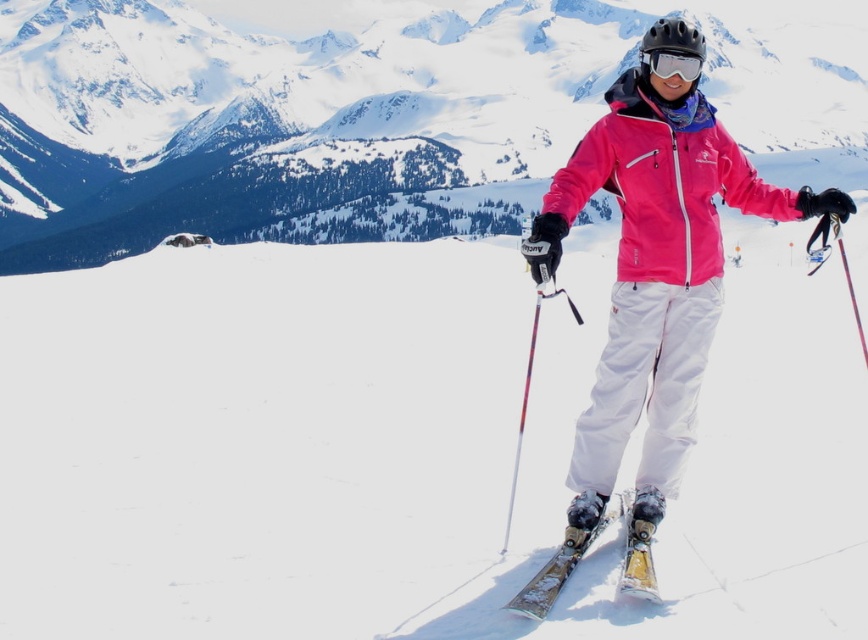
Question: Which point is farther from the camera taking this photo?

Choices:
 (A) pos(695,177)
 (B) pos(324,118)
 (C) pos(755,204)

Answer: (B)

Question: Is pink softshell jacket at center to the left of metallic gold ski at center from the viewer's perspective?

Choices:
 (A) yes
 (B) no

Answer: (B)

Question: Which is nearer to the transparent plastic goggles at center?

Choices:
 (A) pink softshell jacket at center
 (B) metallic gold ski at center

Answer: (A)

Question: Is metallic gold ski at lower center below transparent plastic goggles at center?

Choices:
 (A) no
 (B) yes

Answer: (B)

Question: Based on their relative distances, which object is nearer to the metallic gold ski at center?

Choices:
 (A) snowy mountain at center
 (B) pink softshell jacket at center

Answer: (B)

Question: Does snowy mountain at center have a lesser width compared to metallic gold ski at lower center?

Choices:
 (A) no
 (B) yes

Answer: (A)